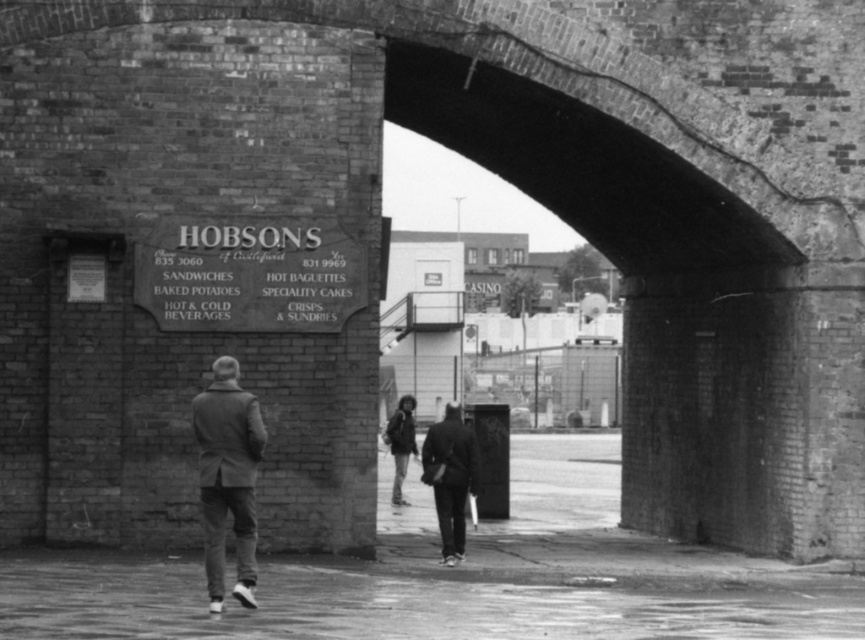
You are a fashion designer observing the urban scene through the brick archway. You notice two garments hanging on a rack at the center of the image. Which one is taller between the dark gray wool coat at center and the dark gray fabric jacket at center?

The dark gray wool coat at center is taller than the dark gray fabric jacket at center.

You are trying to decide which item to take with you based on their size. You see a dark gray wool coat at center and a dark gray fabric jacket at center. Which one is smaller?

The dark gray wool coat at center is smaller than the dark gray fabric jacket at center because it occupies less space.